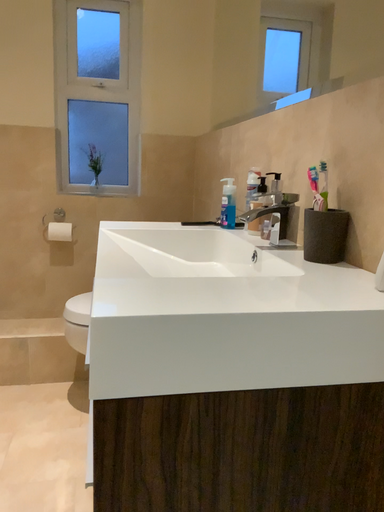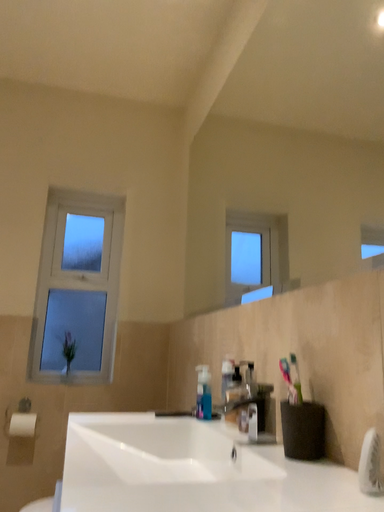
Question: How did the camera likely rotate when shooting the video?

Choices:
 (A) rotated downward
 (B) rotated upward

Answer: (B)